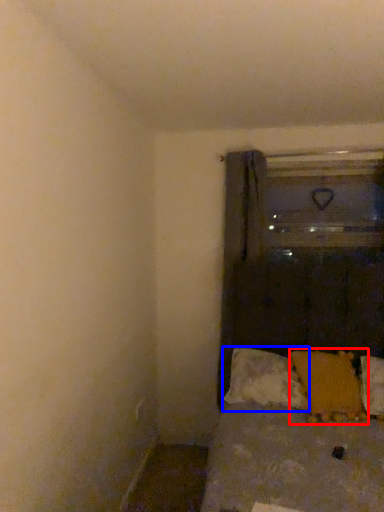
Question: Among these objects, which one is farthest to the camera, pillow (highlighted by a red box) or pillow (highlighted by a blue box)?

Choices:
 (A) pillow
 (B) pillow

Answer: (B)